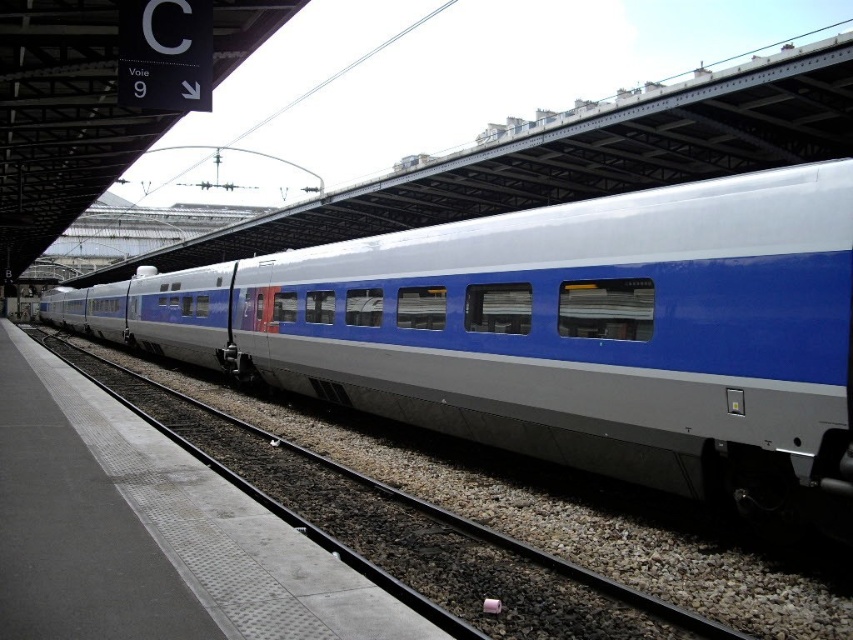
You are a passenger waiting at the station platform. You see the metallic blue train at center and the metallic gray track at center. Which object is closer to the edge of the platform?

The metallic blue train at center is positioned on the left side of the metallic gray track at center, so the metallic gray track at center is closer to the edge of the platform.

You are a maintenance worker who needs to check the clearance of the metallic blue train at center against the metallic gray track at center. Based on the scene, can you determine if the train will fit on the track?

The metallic blue train at center is much taller than the metallic gray track at center, so it will not fit on the track due to insufficient clearance.